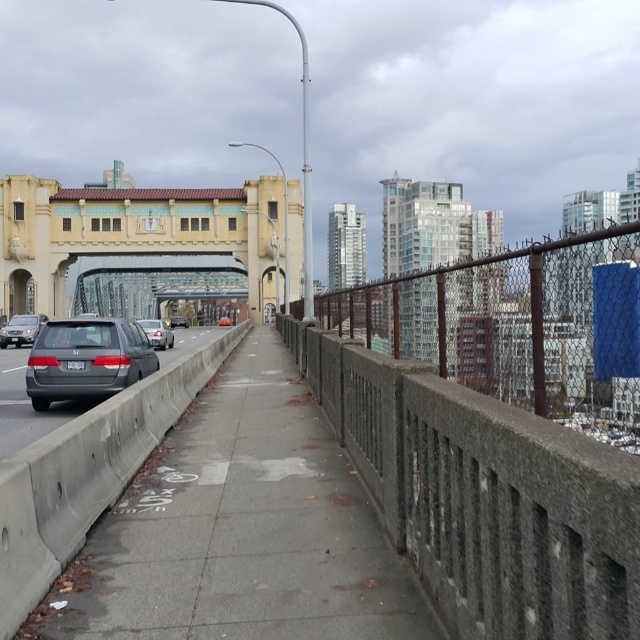
Consider the image. You are standing on the beige concrete bridge at center and want to cross to the other side. Which direction should you walk to reach the end of the bridge?

The beige concrete bridge at center is located at point (145,246), so you should walk towards the direction where the coordinates increase or decrease based on the bridge orientation to reach the end.